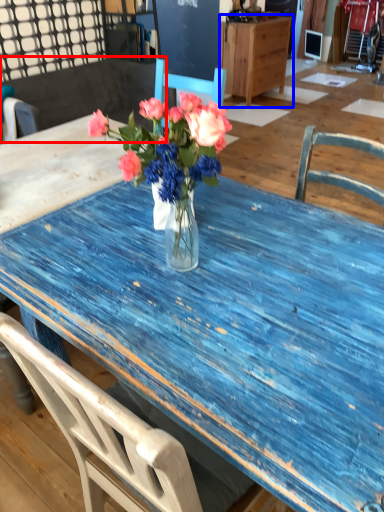
Question: Which of the following is the closest to the observer, chair (highlighted by a red box) or cabinetry (highlighted by a blue box)?

Choices:
 (A) chair
 (B) cabinetry

Answer: (A)